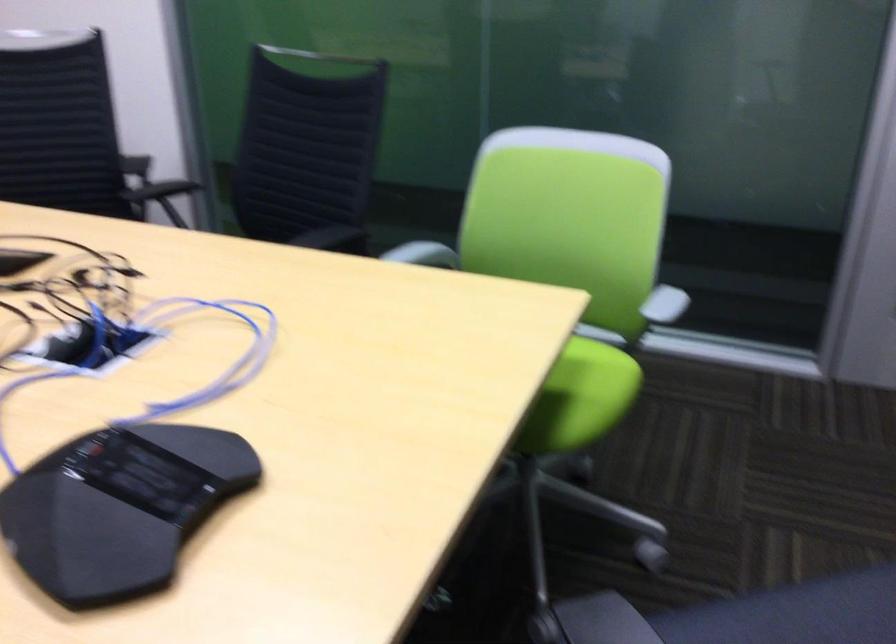
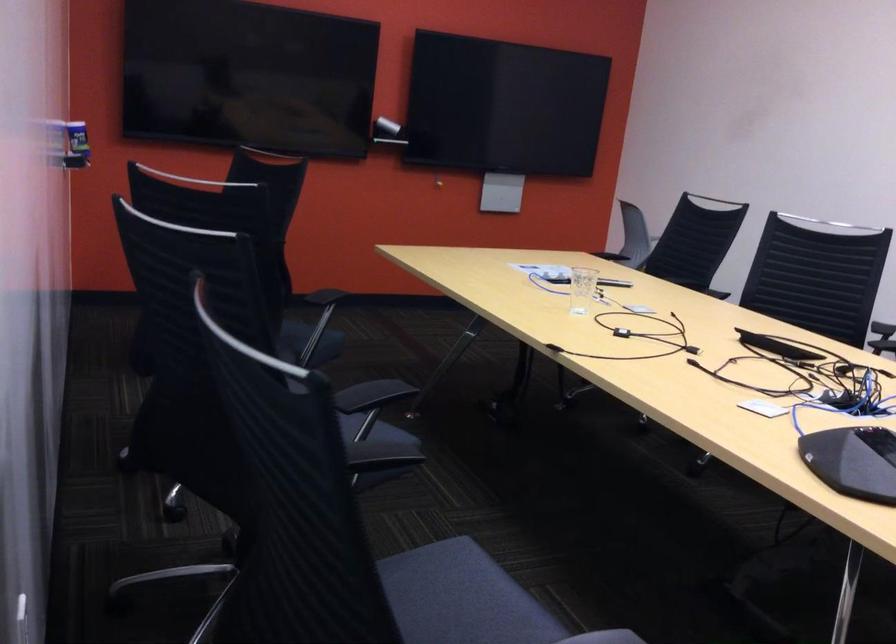
The point at [90,509] is marked in the first image. Where is the corresponding point in the second image?

(853, 460)